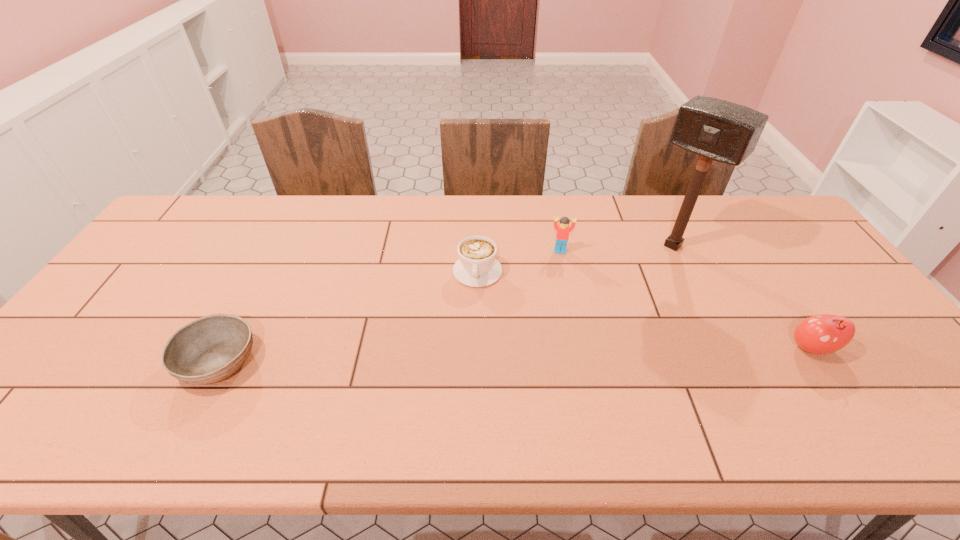
I want to click on object that is at the near edge, so click(x=209, y=349).

The height and width of the screenshot is (540, 960). Identify the location of object present at the right edge. (821, 334).

Identify the location of blank space at the far edge. (434, 218).

The height and width of the screenshot is (540, 960). Identify the location of vacant space at the near edge of the desktop. (222, 401).

The image size is (960, 540). In the image, there is a desktop. What are the coordinates of `free space at the left edge` in the screenshot? It's located at (110, 330).

You are a GUI agent. You are given a task and a screenshot of the screen. Output one action in this format:
    pyautogui.click(x=<x>, y=<y>)
    Task: Click on the vacant space at the right edge of the desktop
    
    Given the screenshot: What is the action you would take?
    pyautogui.click(x=792, y=258)

In order to click on free location at the far left corner in this screenshot , I will do `click(209, 203)`.

At what (x,y) coordinates should I click in order to perform the action: click on vacant region at the near left corner of the desktop. Please return your answer as a coordinate pair (x, y). The width and height of the screenshot is (960, 540). Looking at the image, I should click on (40, 389).

Where is `vacant space that is in between the fourth tallest object and the leftmost object`? vacant space that is in between the fourth tallest object and the leftmost object is located at coordinates (348, 317).

This screenshot has width=960, height=540. Identify the location of vacant point located between the mallet and the rightmost object. (742, 297).